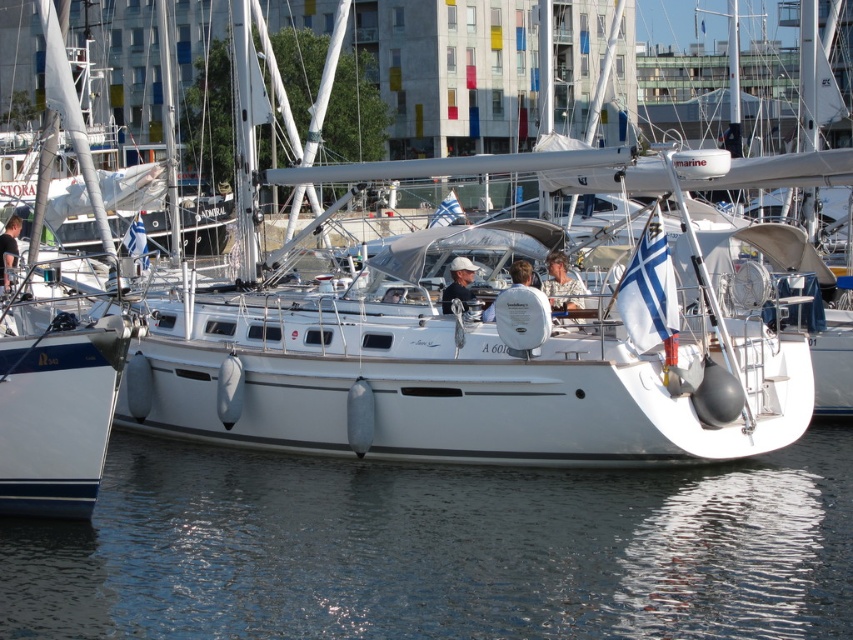
Between transparent water at lower center and white matte sailboat at center, which one has more height?

white matte sailboat at center

Identify the location of transparent water at lower center. The image size is (853, 640). (438, 548).

Which is in front, point (836, 628) or point (560, 444)?

Point (836, 628) is more forward.

You are a GUI agent. You are given a task and a screenshot of the screen. Output one action in this format:
    pyautogui.click(x=<x>, y=<y>)
    Task: Click on the transparent water at lower center
    This screenshot has width=853, height=640.
    Given the screenshot: What is the action you would take?
    pyautogui.click(x=438, y=548)